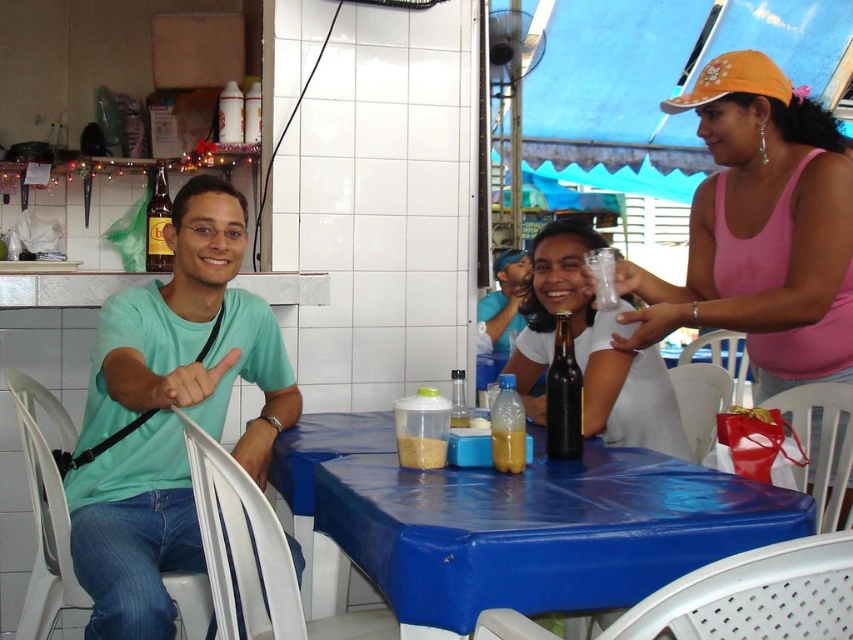
You are a waiter at the outdoor dining area. You need to retrieve the translucent plastic bottle at table center and the brown glass bottle at upper left. Which one is closer to you if you are standing behind the blue plastic table?

The translucent plastic bottle at table center is closer to you because it is in front of the brown glass bottle at upper left, meaning it is nearer to your position behind the table.